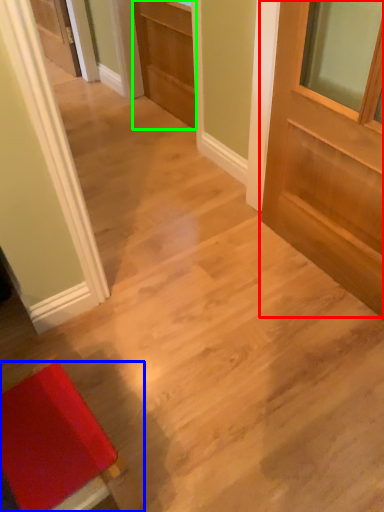
Question: Based on their relative distances, which object is nearer to door (highlighted by a red box)? Choose from furniture (highlighted by a blue box) and door (highlighted by a green box).

Choices:
 (A) furniture
 (B) door

Answer: (B)